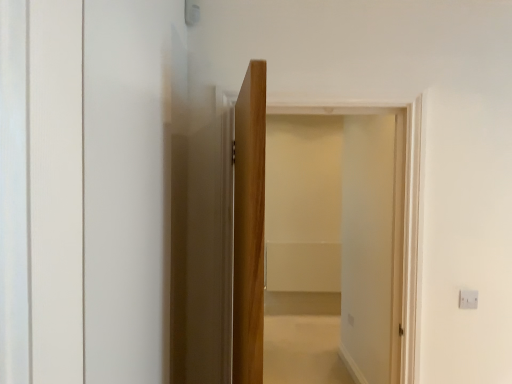
Question: Could clear glass screen door at center be considered to be inside light brown wood door at center?

Choices:
 (A) yes
 (B) no

Answer: (B)

Question: From a real-world perspective, does light brown wood door at center stand above clear glass screen door at center?

Choices:
 (A) no
 (B) yes

Answer: (B)

Question: Does light brown wood door at center have a lesser height compared to clear glass screen door at center?

Choices:
 (A) yes
 (B) no

Answer: (A)

Question: Is light brown wood door at center positioned beyond the bounds of clear glass screen door at center?

Choices:
 (A) no
 (B) yes

Answer: (B)

Question: Considering the relative positions of light brown wood door at center and clear glass screen door at center in the image provided, is light brown wood door at center in front of clear glass screen door at center?

Choices:
 (A) no
 (B) yes

Answer: (B)

Question: Considering the relative sizes of light brown wood door at center and clear glass screen door at center in the image provided, is light brown wood door at center bigger than clear glass screen door at center?

Choices:
 (A) no
 (B) yes

Answer: (A)

Question: Is clear glass screen door at center completely or partially outside of light brown wood door at center?

Choices:
 (A) yes
 (B) no

Answer: (A)

Question: From the image's perspective, is clear glass screen door at center on top of light brown wood door at center?

Choices:
 (A) no
 (B) yes

Answer: (B)

Question: Is clear glass screen door at center smaller than light brown wood door at center?

Choices:
 (A) yes
 (B) no

Answer: (B)

Question: Is clear glass screen door at center directly adjacent to light brown wood door at center?

Choices:
 (A) no
 (B) yes

Answer: (A)

Question: From the image's perspective, is clear glass screen door at center under light brown wood door at center?

Choices:
 (A) no
 (B) yes

Answer: (A)

Question: Is light brown wood door at center located within clear glass screen door at center?

Choices:
 (A) yes
 (B) no

Answer: (B)

Question: Visually, is light brown wood door at center positioned to the left or to the right of clear glass screen door at center?

Choices:
 (A) left
 (B) right

Answer: (A)